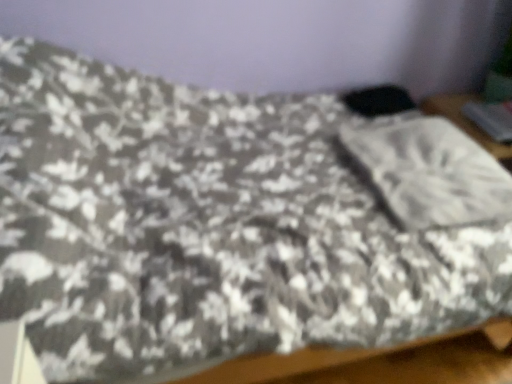
Question: Is point (494, 129) positioned closer to the camera than point (415, 134)?

Choices:
 (A) farther
 (B) closer

Answer: (A)

Question: In terms of size, does metallic gray laptop at upper right appear bigger or smaller than white textured pillow at center?

Choices:
 (A) big
 (B) small

Answer: (B)

Question: From a real-world perspective, is metallic gray laptop at upper right positioned above or below white textured pillow at center?

Choices:
 (A) below
 (B) above

Answer: (A)

Question: Is white textured pillow at center wider or thinner than metallic gray laptop at upper right?

Choices:
 (A) wide
 (B) thin

Answer: (A)

Question: Based on their sizes in the image, would you say white textured pillow at center is bigger or smaller than metallic gray laptop at upper right?

Choices:
 (A) small
 (B) big

Answer: (B)

Question: Is white textured pillow at center taller or shorter than metallic gray laptop at upper right?

Choices:
 (A) tall
 (B) short

Answer: (A)

Question: Considering the positions of point (352, 140) and point (480, 112), is point (352, 140) closer or farther from the camera than point (480, 112)?

Choices:
 (A) farther
 (B) closer

Answer: (B)